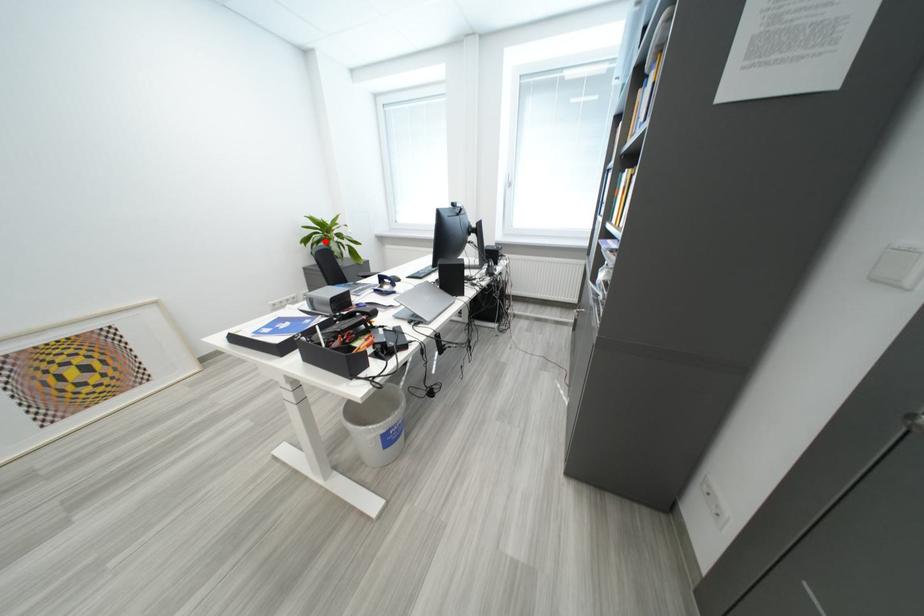
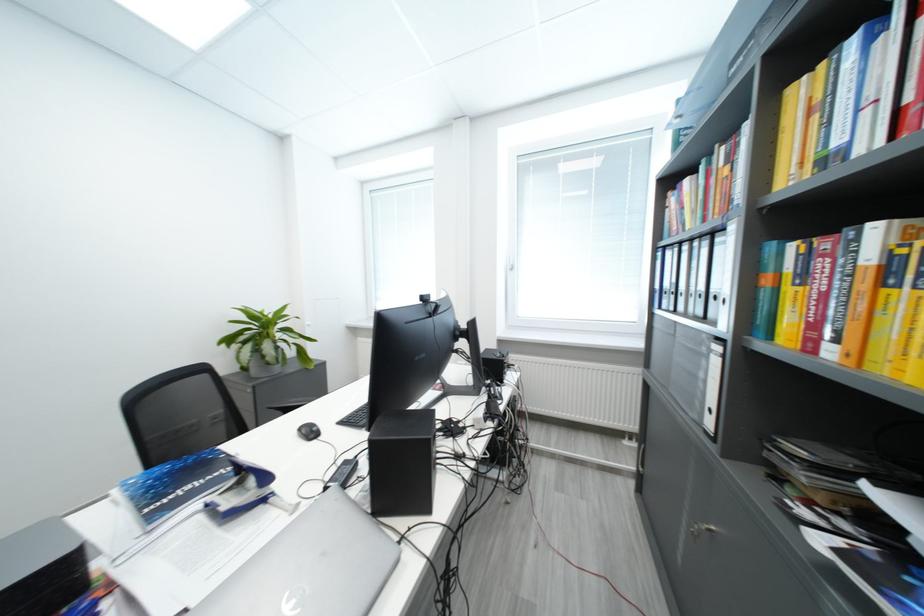
Locate, in the second image, the point that corresponds to the highlighted location in the first image.

(251, 341)